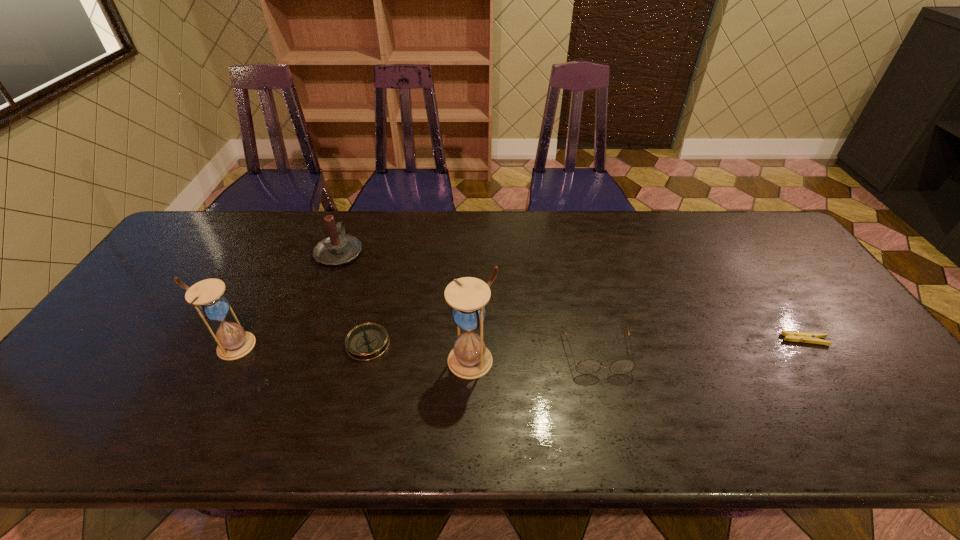
Locate an element on the screen. This screenshot has width=960, height=540. vacant region between the rightmost object and the fifth object from right to left is located at coordinates pos(572,296).

This screenshot has height=540, width=960. Find the location of `unoccupied area between the shortest object and the farthest object`. unoccupied area between the shortest object and the farthest object is located at coordinates (572, 296).

Identify the location of vacant area between the rightmost object and the tallest object. This screenshot has height=540, width=960. (638, 350).

This screenshot has width=960, height=540. In order to click on vacant space that is in between the leftmost object and the rightmost object in this screenshot , I will do `click(518, 342)`.

Find the location of a particular element. free space between the left hourglass and the fifth object from right to left is located at coordinates (286, 299).

This screenshot has width=960, height=540. In order to click on vacant space that is in between the spectacles and the leftmost object in this screenshot , I will do coord(416,349).

Locate an element on the screen. This screenshot has width=960, height=540. object that stands as the third closest to the second tallest object is located at coordinates (469, 359).

Where is `object that stands as the closest to the taller hourglass`? The height and width of the screenshot is (540, 960). object that stands as the closest to the taller hourglass is located at coordinates (367, 341).